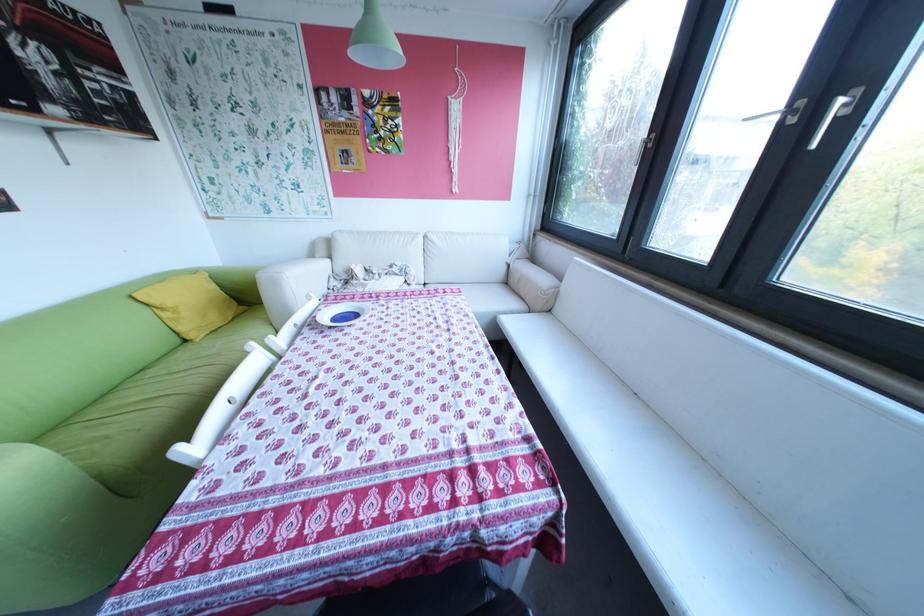
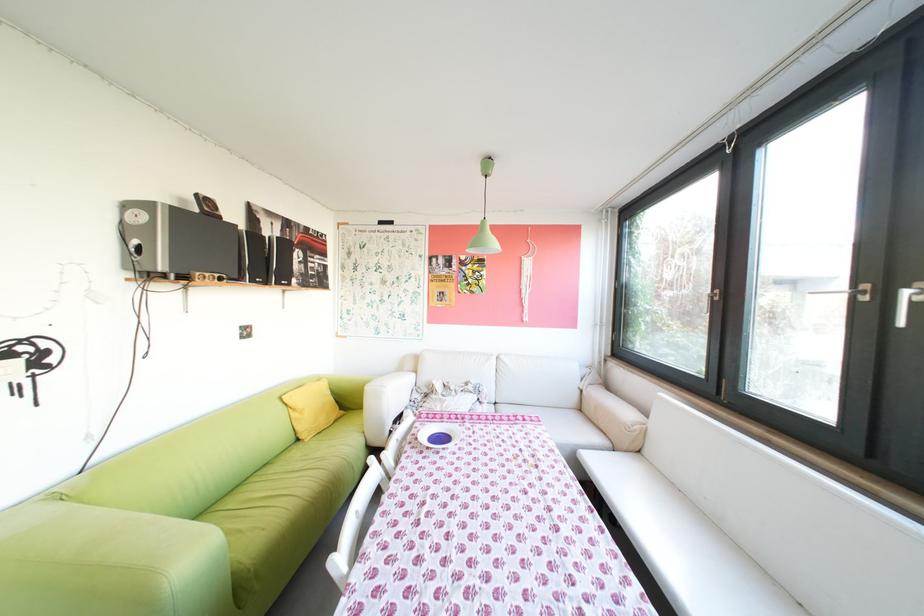
Which direction would the cameraman need to move to produce the second image?

The cameraman walked toward left, backward.